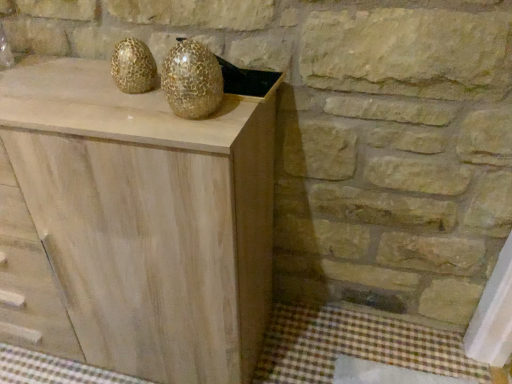
Locate an element on the screen. The height and width of the screenshot is (384, 512). free space on the front side of gold textured vase at center is located at coordinates (190, 126).